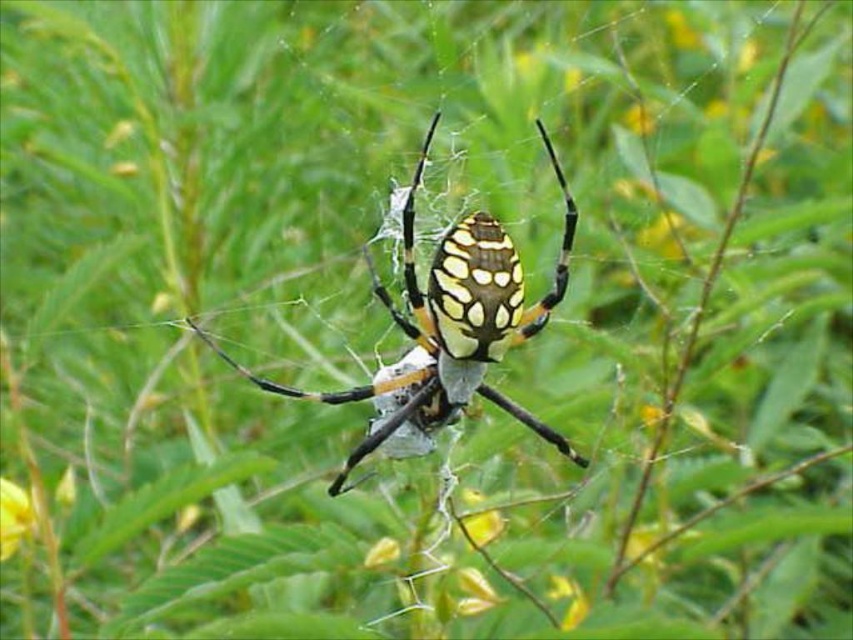
Does yellow and black striped spider at center appear over yellow matte flower at lower left?

Correct, yellow and black striped spider at center is located above yellow matte flower at lower left.

Is yellow and black striped spider at center below yellow matte flower at lower left?

No, yellow and black striped spider at center is not below yellow matte flower at lower left.

Does point (492, 316) come farther from viewer compared to point (9, 541)?

Yes, it is behind point (9, 541).

Locate an element on the screen. The width and height of the screenshot is (853, 640). yellow and black striped spider at center is located at coordinates (450, 323).